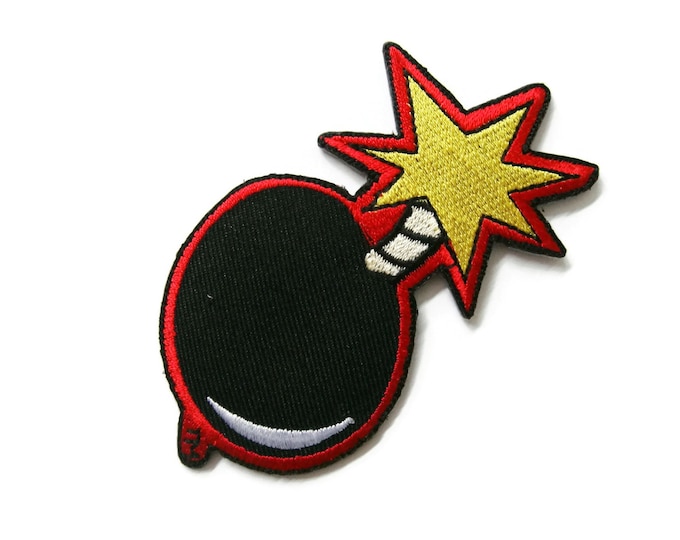
The width and height of the screenshot is (680, 540). In order to click on wall in this screenshot , I will do `click(96, 301)`.